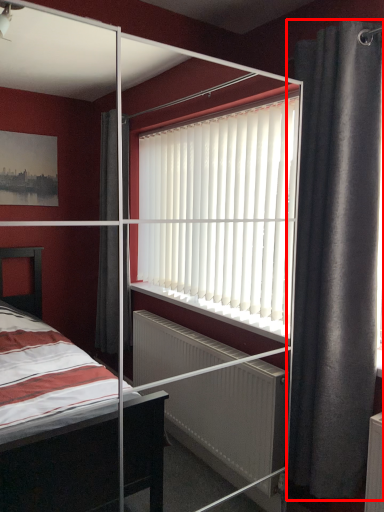
Question: Considering the relative positions of curtain (annotated by the red box) and screen door in the image provided, where is curtain (annotated by the red box) located with respect to the staircase?

Choices:
 (A) right
 (B) left

Answer: (A)